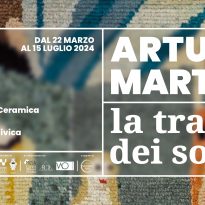
Identify the location of character in painting. This screenshot has height=205, width=205. (101, 184).